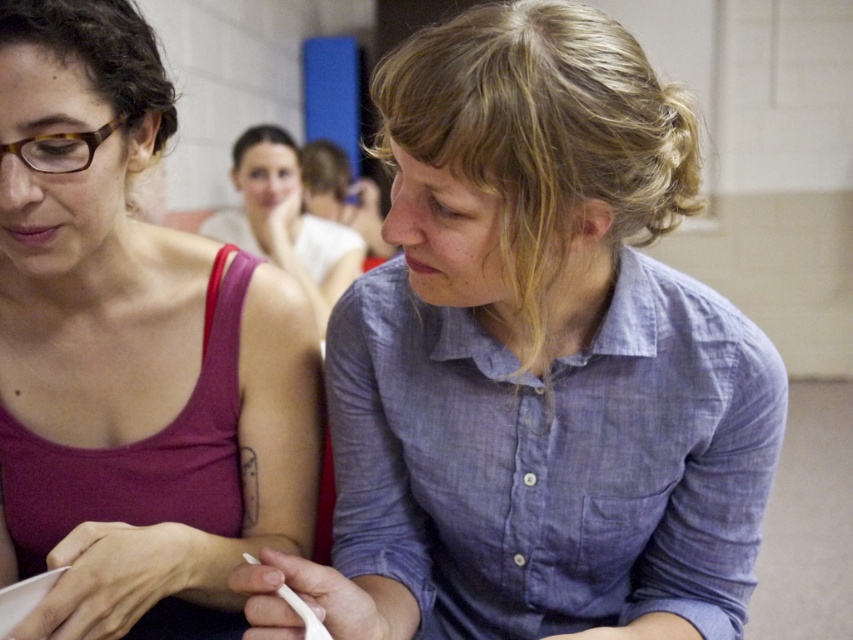
Question: Based on their relative distances, which object is farther from the matte red tank top at left?

Choices:
 (A) blue cotton shirt at center
 (B) matte blue shirt at center

Answer: (B)

Question: Does blue cotton shirt at center appear on the right side of matte blue shirt at center?

Choices:
 (A) no
 (B) yes

Answer: (B)

Question: Which point is farther from the camera taking this photo?

Choices:
 (A) 556,124
 (B) 332,285
 (C) 53,340

Answer: (B)

Question: Based on their relative distances, which object is nearer to the matte blue shirt at center?

Choices:
 (A) blue cotton shirt at center
 (B) matte red tank top at left

Answer: (B)

Question: Does blue cotton shirt at center appear on the left side of matte blue shirt at center?

Choices:
 (A) yes
 (B) no

Answer: (B)

Question: Can you confirm if matte red tank top at left is positioned above matte blue shirt at center?

Choices:
 (A) no
 (B) yes

Answer: (A)